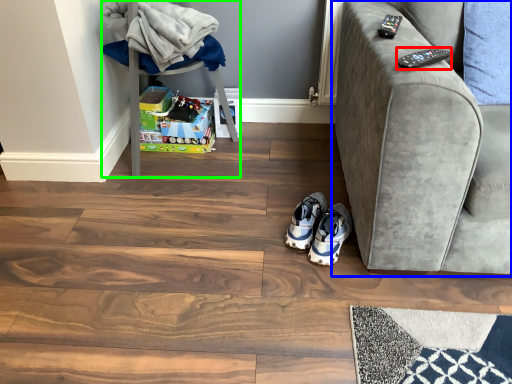
Question: Considering the real-world distances, which object is closest to remote (highlighted by a red box)? studio couch (highlighted by a blue box) or furniture (highlighted by a green box).

Choices:
 (A) studio couch
 (B) furniture

Answer: (A)